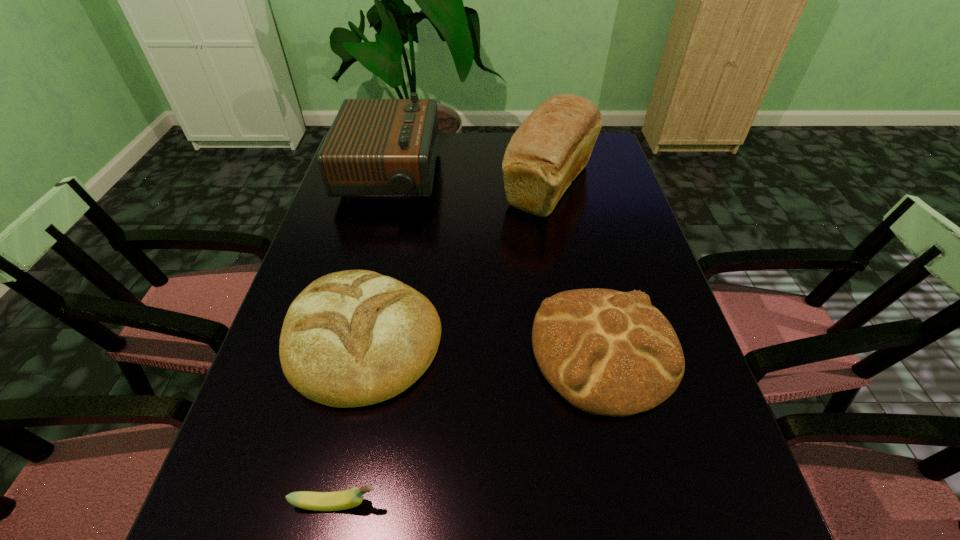
Identify the location of free space in the image that satisfies the following two spatial constraints: 1. on the tuning display of the leftmost bread; 2. on the left side of the radio receiver. (348, 338).

At what (x,y) coordinates should I click in order to perform the action: click on free space that satisfies the following two spatial constraints: 1. on the back side of the leftmost bread; 2. on the tuning display of the second tallest object. Please return your answer as a coordinate pair (x, y). The width and height of the screenshot is (960, 540). Looking at the image, I should click on (400, 177).